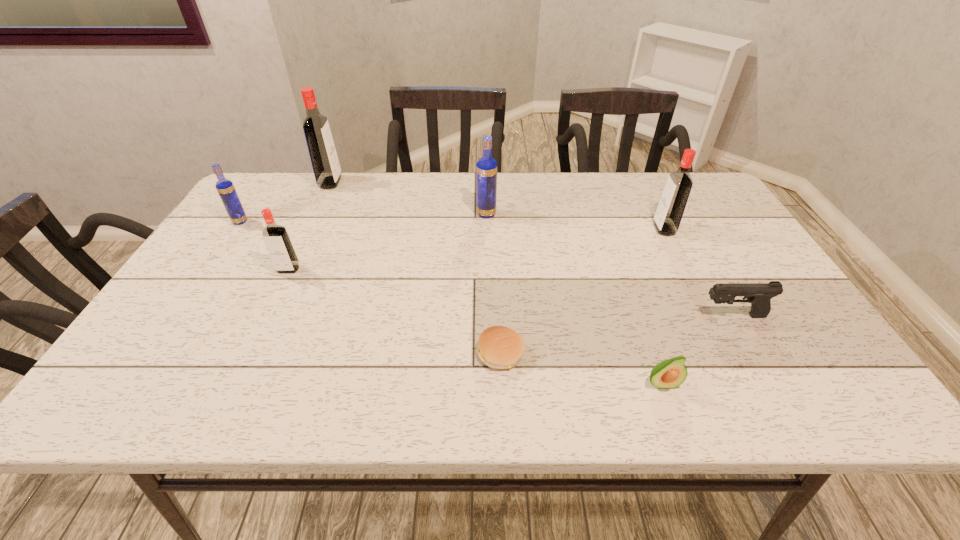
Locate an element on the screen. The width and height of the screenshot is (960, 540). blank area at the far edge is located at coordinates pos(433,178).

At what (x,y) coordinates should I click in order to perform the action: click on vacant space at the near edge of the desktop. Please return your answer as a coordinate pair (x, y). Looking at the image, I should click on (756, 410).

The height and width of the screenshot is (540, 960). Identify the location of vacant space at the right edge of the desktop. (706, 255).

Locate an element on the screen. The image size is (960, 540). vacant space at the far left corner of the desktop is located at coordinates (306, 178).

The image size is (960, 540). What are the coordinates of `vacant region at the near right corner` in the screenshot? It's located at (805, 401).

Where is `free space between the second vodka from right to left and the farthest vodka`? free space between the second vodka from right to left and the farthest vodka is located at coordinates (408, 198).

Where is `vacant space in between the smaller blue vodka and the avocado`? vacant space in between the smaller blue vodka and the avocado is located at coordinates (451, 302).

Find the location of a particular element. This screenshot has height=540, width=960. vacant area that lies between the bigger blue vodka and the tallest object is located at coordinates (408, 198).

Where is `vacant point located between the smaller blue vodka and the tallest vodka`? vacant point located between the smaller blue vodka and the tallest vodka is located at coordinates (285, 202).

In order to click on free space that is in between the fourth nearest object and the farthest vodka in this screenshot , I will do `click(309, 226)`.